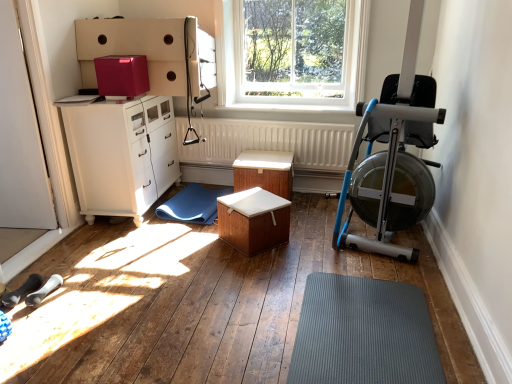
This screenshot has width=512, height=384. Find the location of `free area in between gray rubber mat at lower center, acting as the first doormat starting from the bottom, and silver metallic rowing machine at right`. free area in between gray rubber mat at lower center, acting as the first doormat starting from the bottom, and silver metallic rowing machine at right is located at coordinates (370, 273).